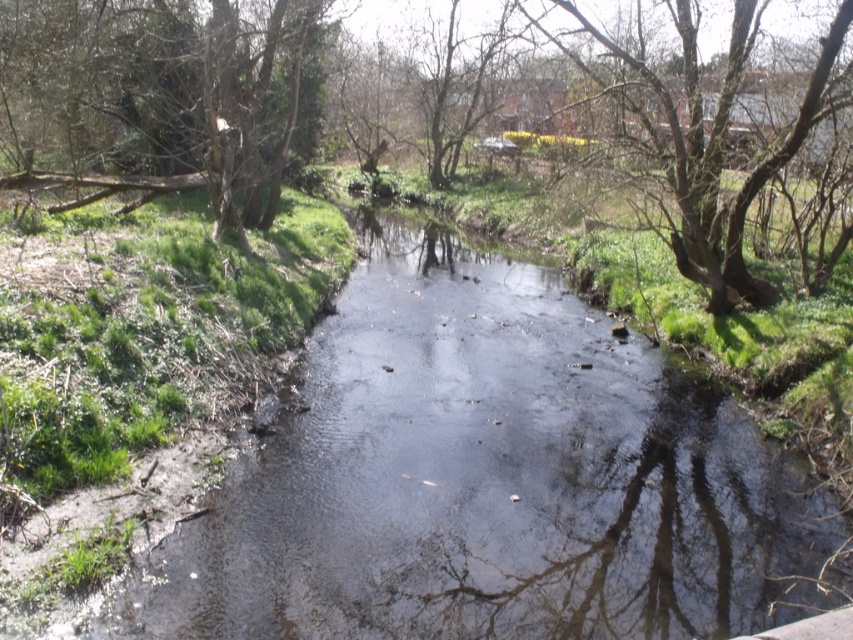
Question: Which point is farther from the camera taking this photo?

Choices:
 (A) (109, 193)
 (B) (712, 308)
 (C) (347, 566)

Answer: (A)

Question: Can you confirm if green leafy tree at left is positioned to the left of bare branches at upper right?

Choices:
 (A) no
 (B) yes

Answer: (B)

Question: Can you confirm if transparent water at center is smaller than bare branches at upper right?

Choices:
 (A) yes
 (B) no

Answer: (A)

Question: Which object appears closest to the camera in this image?

Choices:
 (A) green leafy tree at left
 (B) transparent water at center
 (C) bare branches at upper right

Answer: (B)

Question: Which of the following is the closest to the observer?

Choices:
 (A) green leafy tree at left
 (B) transparent water at center
 (C) bare branches at upper right

Answer: (B)

Question: Does green leafy tree at left appear over bare branches at upper right?

Choices:
 (A) no
 (B) yes

Answer: (B)